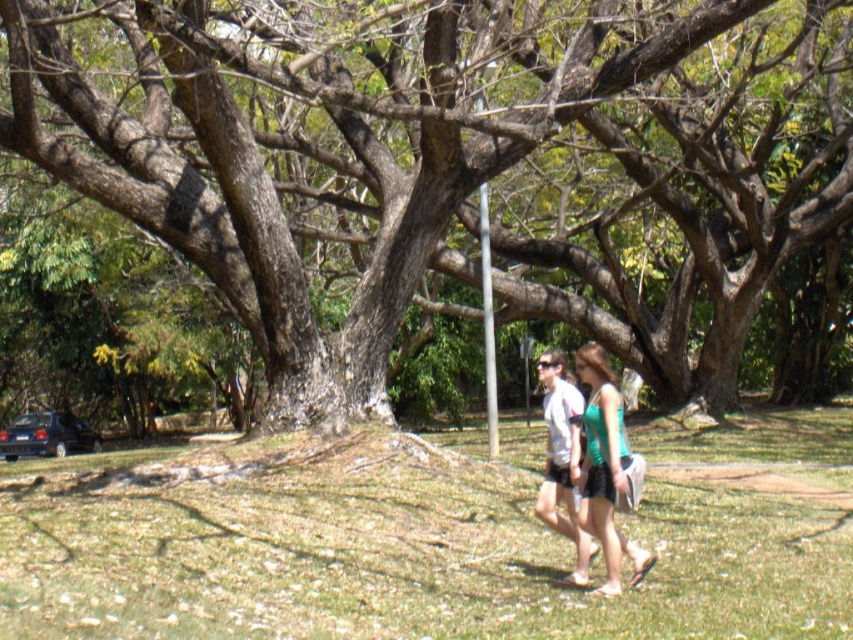
Question: Which point is farther to the camera?

Choices:
 (A) brown rough tree at center
 (B) green grass at center

Answer: (A)

Question: Does brown rough tree at center have a smaller size compared to white matte shirt at center?

Choices:
 (A) no
 (B) yes

Answer: (A)

Question: In this image, where is green grass at center located relative to brown rough tree at center?

Choices:
 (A) left
 (B) right

Answer: (B)

Question: Does green fabric shorts at center appear under white matte shirt at center?

Choices:
 (A) no
 (B) yes

Answer: (A)

Question: Among these objects, which one is farthest from the camera?

Choices:
 (A) white matte shirt at center
 (B) brown rough tree at center

Answer: (A)

Question: Which object appears farthest from the camera in this image?

Choices:
 (A) green grass at center
 (B) white matte shirt at center
 (C) brown rough tree at center

Answer: (B)